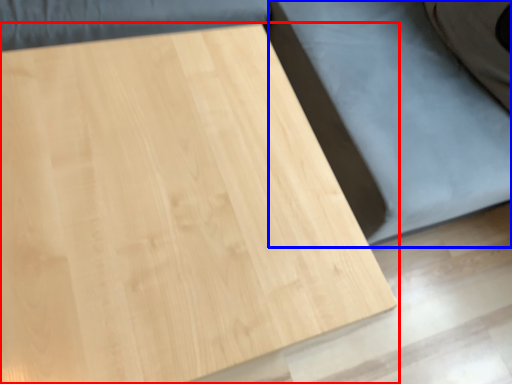
Question: Which object appears closest to the camera in this image, table (highlighted by a red box) or bed frame (highlighted by a blue box)?

Choices:
 (A) table
 (B) bed frame

Answer: (A)